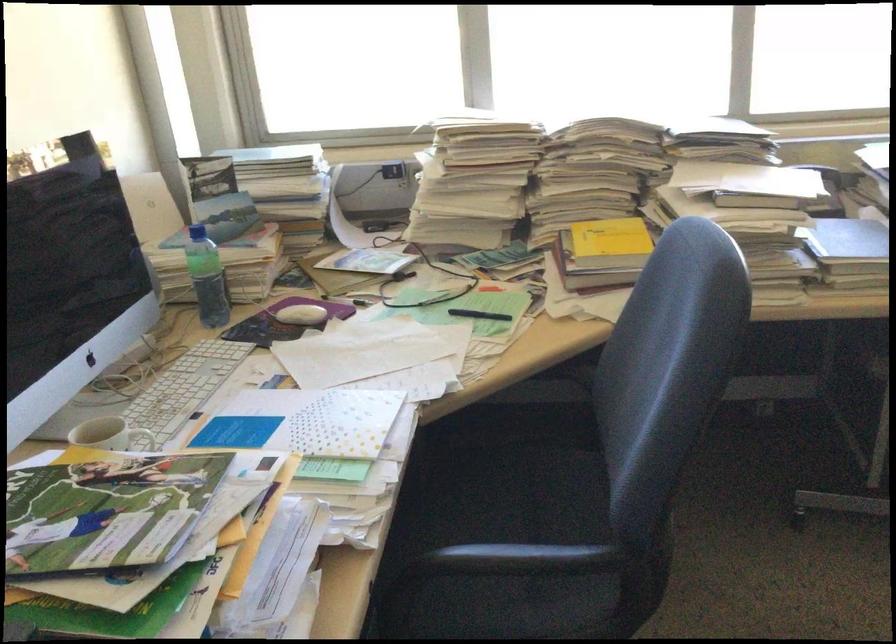
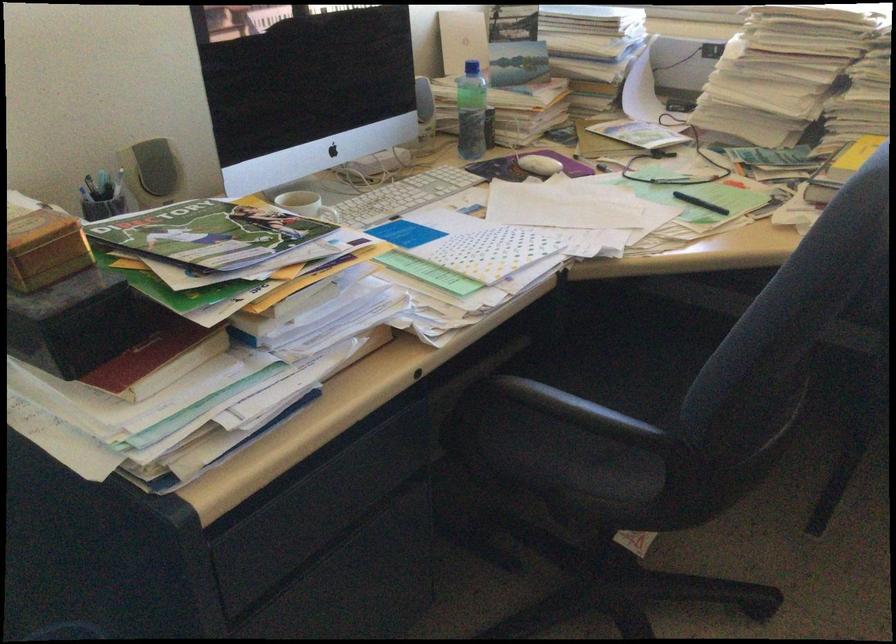
Question: I am providing you with two images of the same scene from different viewpoints. Which of the following objects are not visible in image2?

Choices:
 (A) black drawer pull
 (B) white cup handle
 (C) small brown box
 (D) none of these

Answer: (D)